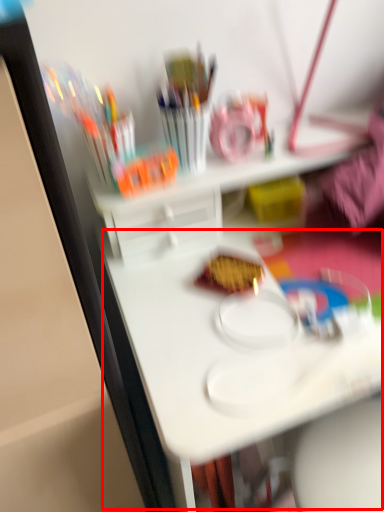
Question: From the image's perspective, what is the correct spatial relationship of table (annotated by the red box) in relation to food?

Choices:
 (A) below
 (B) above

Answer: (A)